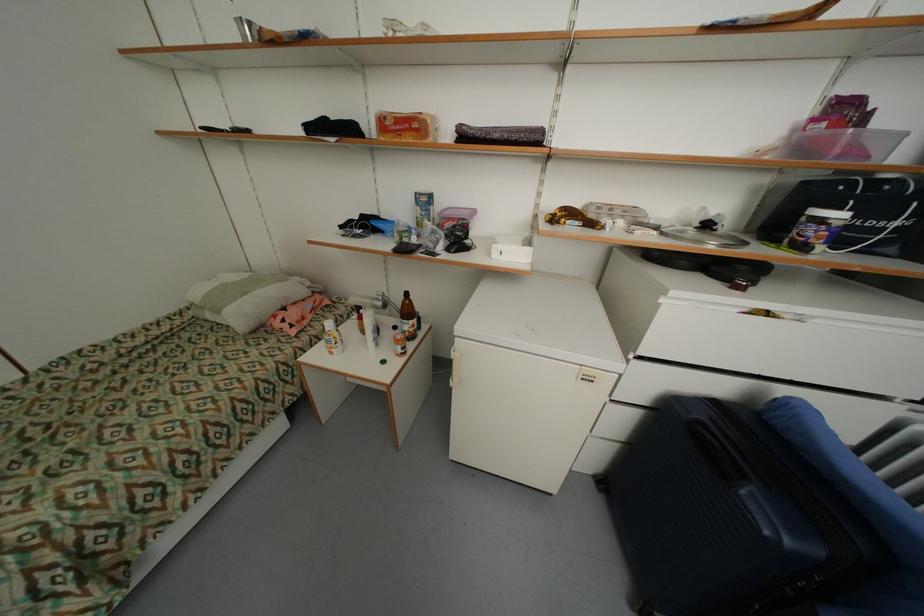
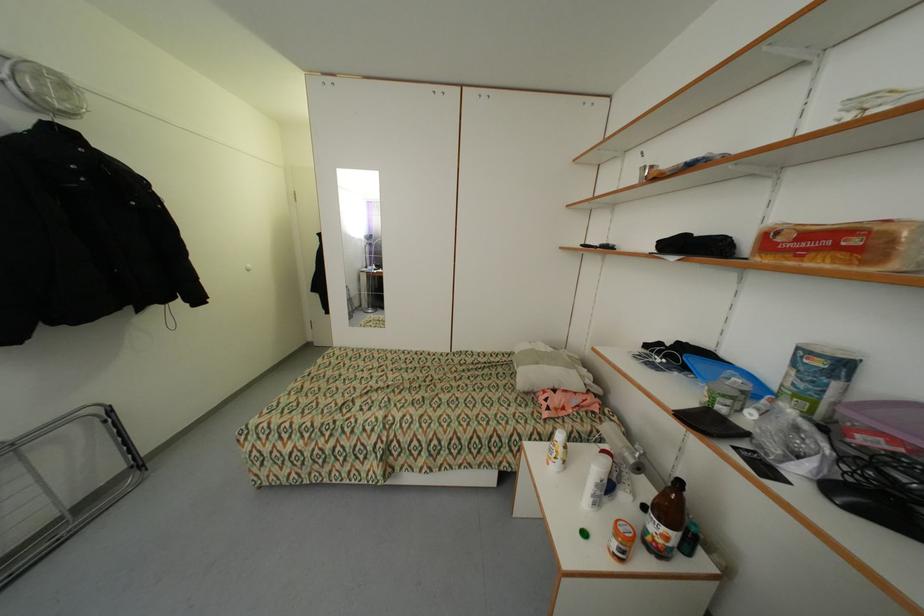
Where in the second image is the point corresponding to [421,126] from the first image?

(860, 241)